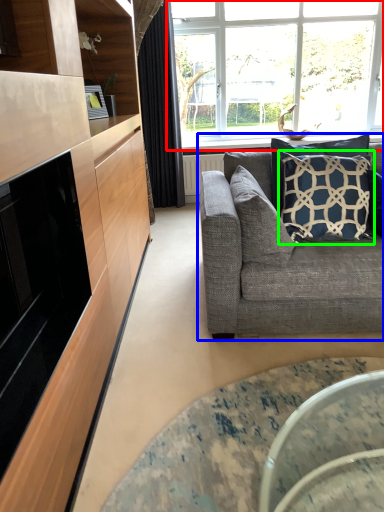
Question: Which object is the closest to the window (highlighted by a red box)? Choose among these: studio couch (highlighted by a blue box) or pillow (highlighted by a green box).

Choices:
 (A) studio couch
 (B) pillow

Answer: (B)